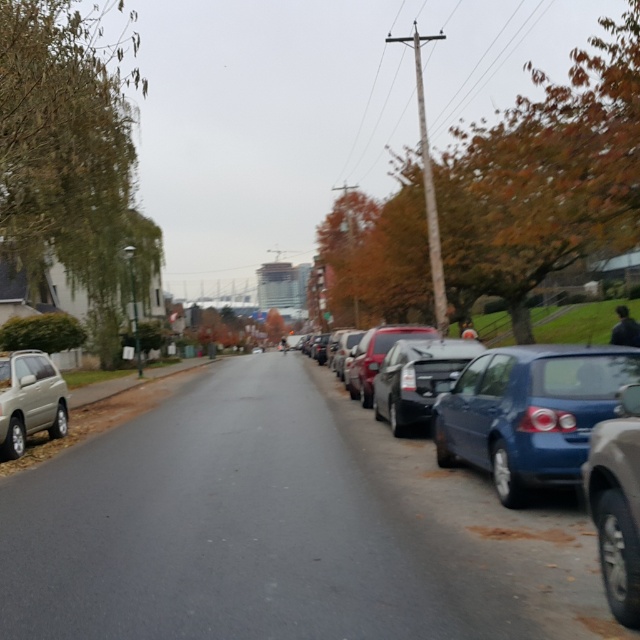
You are a delivery person with a cart that is 2 meters wide. You need to move from the lamppost to the house in the background. The path between the metallic blue sedan at right and the matte beige suv at lower left is the only route available. Can your cart fit through this path?

The metallic blue sedan at right is 7.40 meters away from the matte beige suv at lower left. Since the cart is only 2 meters wide, it can easily fit through the 7.40 meter gap between the two vehicles.

You are a pedestrian standing on the sidewalk on the left side of the street. You want to cross the street to reach the house in the background. Which sedan, the metallic blue sedan at right or the satin black sedan at right, is closer to the curb on the right side of the street?

The metallic blue sedan at right is closer to the curb on the right side of the street because it is positioned below the satin black sedan at right, indicating it is lower in the image and thus closer to the ground level near the curb.

You are a delivery person trying to park your van between the satin black sedan at right and the matte beige suv at lower left. Can you fit your van, which is 5 meters long, in the space between them?

The satin black sedan at right is larger in size than the matte beige suv at lower left, but without knowing the exact distance between them, it is impossible to determine if the 5 meter van can fit.